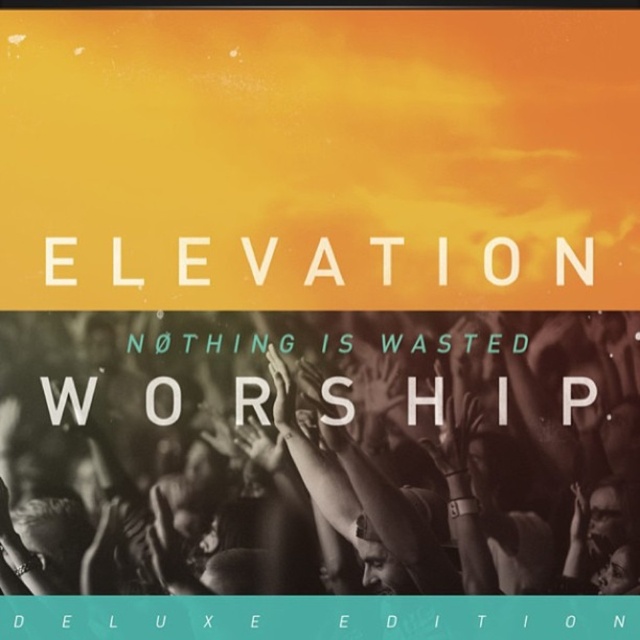
Who is lower down, black matte hands at center or white matte text at center?

black matte hands at center is lower down.

Does black matte hands at center have a greater width compared to white matte text at center?

Yes, black matte hands at center is wider than white matte text at center.

Which is behind, point (612, 403) or point (68, 273)?

The point (612, 403) is more distant.

The width and height of the screenshot is (640, 640). In order to click on black matte hands at center in this screenshot , I will do `click(337, 444)`.